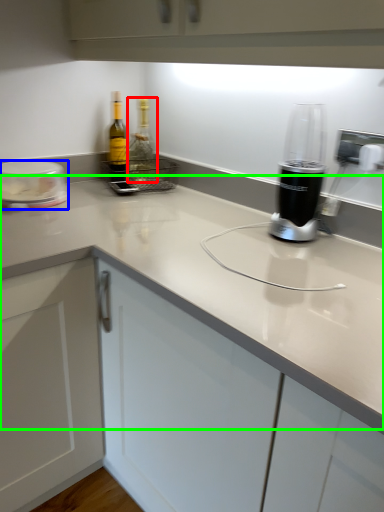
Question: Which object is the farthest from bottle (highlighted by a red box)? Choose among these: kitchen appliance (highlighted by a blue box) or counter top (highlighted by a green box).

Choices:
 (A) kitchen appliance
 (B) counter top

Answer: (B)